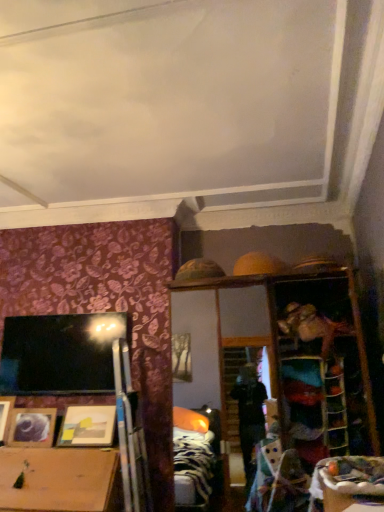
Question: Could wooden picture frame at lower left, positioned as the first picture frame in left-to-right order, be considered to be inside wooden table at lower right?

Choices:
 (A) yes
 (B) no

Answer: (B)

Question: Considering the relative sizes of wooden table at lower right and wooden picture frame at lower left, positioned as the first picture frame in left-to-right order, in the image provided, is wooden table at lower right smaller than wooden picture frame at lower left, positioned as the first picture frame in left-to-right order,?

Choices:
 (A) yes
 (B) no

Answer: (A)

Question: Can you confirm if wooden table at lower right is positioned to the right of wooden picture frame at lower left, positioned as the first picture frame in left-to-right order?

Choices:
 (A) no
 (B) yes

Answer: (B)

Question: From the image's perspective, is wooden table at lower right located beneath wooden picture frame at lower left, positioned as the first picture frame in left-to-right order?

Choices:
 (A) no
 (B) yes

Answer: (A)

Question: Is wooden table at lower right taller than wooden picture frame at lower left, arranged as the third picture frame when viewed from the right?

Choices:
 (A) no
 (B) yes

Answer: (A)

Question: Considering the relative sizes of wooden table at lower right and wooden picture frame at lower left, arranged as the third picture frame when viewed from the right, in the image provided, is wooden table at lower right thinner than wooden picture frame at lower left, arranged as the third picture frame when viewed from the right,?

Choices:
 (A) no
 (B) yes

Answer: (A)

Question: Can you confirm if matte wooden picture frame at lower left, arranged as the second picture frame when viewed from the right, is positioned to the left of wooden picture frame at lower left, arranged as the third picture frame when viewed from the right?

Choices:
 (A) yes
 (B) no

Answer: (B)

Question: Does matte wooden picture frame at lower left, which ranks as the second picture frame in left-to-right order, have a lesser height compared to wooden picture frame at lower left, arranged as the third picture frame when viewed from the right?

Choices:
 (A) yes
 (B) no

Answer: (A)

Question: Is matte wooden picture frame at lower left, which ranks as the second picture frame in left-to-right order, closer to camera compared to wooden picture frame at lower left, arranged as the third picture frame when viewed from the right?

Choices:
 (A) yes
 (B) no

Answer: (A)

Question: From the image's perspective, is matte wooden picture frame at lower left, which ranks as the second picture frame in left-to-right order, under wooden picture frame at lower left, positioned as the first picture frame in left-to-right order?

Choices:
 (A) no
 (B) yes

Answer: (B)

Question: Is matte wooden picture frame at lower left, which ranks as the second picture frame in left-to-right order, in contact with wooden picture frame at lower left, arranged as the third picture frame when viewed from the right?

Choices:
 (A) no
 (B) yes

Answer: (A)

Question: Could you tell me if matte wooden picture frame at lower left, which ranks as the second picture frame in left-to-right order, is facing wooden picture frame at lower left, positioned as the first picture frame in left-to-right order?

Choices:
 (A) no
 (B) yes

Answer: (A)

Question: Could you tell me if matte wooden picture frame at lower left, arranged as the 3th picture frame when viewed from the left, is facing wooden table at lower right?

Choices:
 (A) yes
 (B) no

Answer: (B)